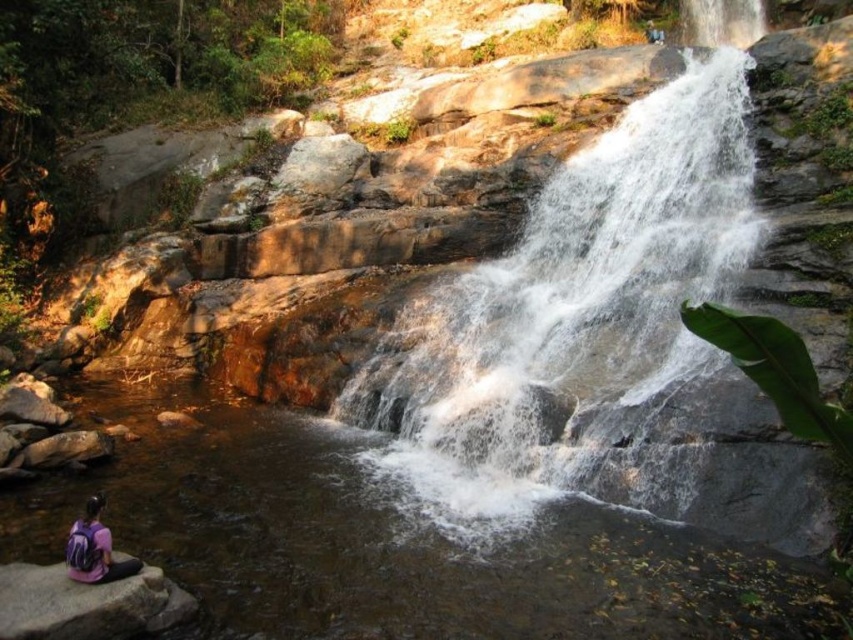
Who is shorter, white frothy water at center or gray rock at lower left?

gray rock at lower left is shorter.

Does white frothy water at center come behind gray rock at lower left?

Yes, white frothy water at center is further from the viewer.

This screenshot has width=853, height=640. Find the location of `white frothy water at center`. white frothy water at center is located at coordinates (573, 316).

From the picture: Which of these two, clear water at center or purple fabric backpack at lower left, stands shorter?

With less height is purple fabric backpack at lower left.

Does clear water at center have a greater height compared to purple fabric backpack at lower left?

Correct, clear water at center is much taller as purple fabric backpack at lower left.

What do you see at coordinates (393, 540) in the screenshot?
I see `clear water at center` at bounding box center [393, 540].

This screenshot has height=640, width=853. What are the coordinates of `clear water at center` in the screenshot? It's located at (393, 540).

Is clear water at center smaller than gray rock at lower left?

No.

Which of these two, clear water at center or gray rock at lower left, stands shorter?

gray rock at lower left

Does point (321, 428) come farther from viewer compared to point (61, 570)?

Yes, it is behind point (61, 570).

This screenshot has width=853, height=640. I want to click on clear water at center, so click(x=393, y=540).